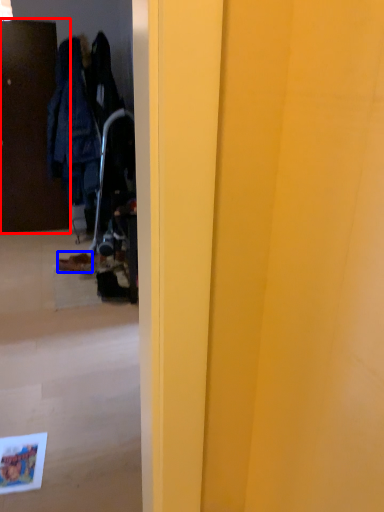
Question: Which object appears closest to the camera in this image, door (highlighted by a red box) or footwear (highlighted by a blue box)?

Choices:
 (A) door
 (B) footwear

Answer: (B)